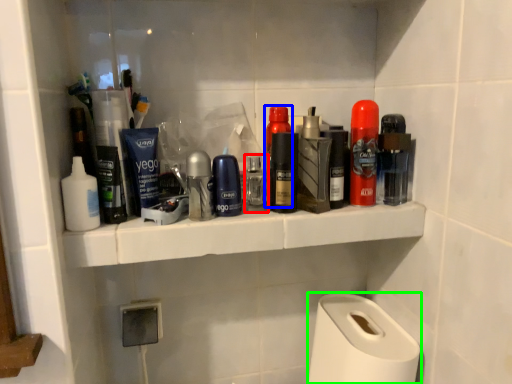
Question: Estimate the real-world distances between objects in this image. Which object is closer to toiletry (highlighted by a red box), personal care (highlighted by a blue box) or paper towel (highlighted by a green box)?

Choices:
 (A) personal care
 (B) paper towel

Answer: (A)